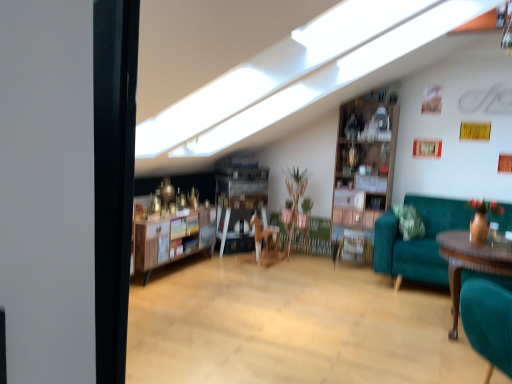
Measure the distance between wooden polished table at right and camera.

wooden polished table at right is 7.50 feet away from camera.

Identify the location of wooden polished table at right. (469, 264).

Is wooden shelf at center with wooden polished table at right?

No.

Considering the positions of points (246, 177) and (498, 268), is point (246, 177) closer to camera compared to point (498, 268)?

No, it is not.

Which object is further away from the camera taking this photo, wooden shelf at center or wooden polished table at right?

wooden shelf at center is further away from the camera.

Does wooden shelf at center appear on the right side of wooden polished table at right?

In fact, wooden shelf at center is to the left of wooden polished table at right.

Can you tell me how much wooden polished table at right and teal fabric couch at right differ in facing direction?

The facing directions of wooden polished table at right and teal fabric couch at right are 2.5 degrees apart.

Does wooden polished table at right appear on the left side of teal fabric couch at right?

Indeed, wooden polished table at right is positioned on the left side of teal fabric couch at right.

Based on the photo, which of these two, wooden polished table at right or teal fabric couch at right, stands taller?

Standing taller between the two is teal fabric couch at right.

Is wooden polished table at right to the left of wooden shelf at center from the viewer's perspective?

No, wooden polished table at right is not to the left of wooden shelf at center.

Is wooden shelf at center completely or partially inside wooden polished table at right?

No, wooden shelf at center is not a part of wooden polished table at right.

Locate an element on the screen. Image resolution: width=512 pixels, height=384 pixels. table in front of the wooden shelf at center is located at coordinates (469, 264).

Can you see wooden polished table at right touching wooden shelf at center?

No, wooden polished table at right is not with wooden shelf at center.

Is teal fabric couch at right behind wooden shelf at center?

That is False.

Measure the distance between teal fabric couch at right and wooden shelf at center.

A distance of 1.77 meters exists between teal fabric couch at right and wooden shelf at center.

Is teal fabric couch at right bigger or smaller than wooden shelf at center?

In the image, teal fabric couch at right appears to be larger than wooden shelf at center.

Are teal fabric couch at right and wooden shelf at center far apart?

Yes, teal fabric couch at right and wooden shelf at center are located far from each other.

Is the position of wooden shelf at center more distant than that of teal fabric couch at right?

Yes, the depth of wooden shelf at center is greater than that of teal fabric couch at right.

Looking at the image, does wooden shelf at center seem bigger or smaller compared to teal fabric couch at right?

Clearly, wooden shelf at center is smaller in size than teal fabric couch at right.

From a real-world perspective, between wooden shelf at center and teal fabric couch at right, who is vertically higher?

From a 3D spatial view, teal fabric couch at right is above.

In terms of size, does teal fabric couch at right appear bigger or smaller than wooden polished table at right?

Clearly, teal fabric couch at right is larger in size than wooden polished table at right.

Which object is more forward, teal fabric couch at right or wooden polished table at right?

wooden polished table at right is more forward.

Is teal fabric couch at right beside wooden polished table at right?

No, teal fabric couch at right is not in contact with wooden polished table at right.

Considering the relative sizes of teal fabric couch at right and wooden polished table at right in the image provided, is teal fabric couch at right wider than wooden polished table at right?

Yes, teal fabric couch at right is wider than wooden polished table at right.

In the image, there is a wooden shelf at center. Identify the location of table below it (from the image's perspective). The image size is (512, 384). (469, 264).

The image size is (512, 384). What are the coordinates of `studio couch above the wooden polished table at right (from a real-world perspective)` in the screenshot? It's located at (418, 240).

Which object lies further to the anchor point teal fabric couch at right, wooden polished table at right or wooden shelf at center?

wooden shelf at center lies further to teal fabric couch at right than the other object.

Estimate the real-world distances between objects in this image. Which object is closer to wooden shelf at center, wooden polished table at right or teal fabric couch at right?

teal fabric couch at right lies closer to wooden shelf at center than the other object.

Considering their positions, is wooden shelf at center positioned further to teal fabric couch at right than wooden polished table at right?

Based on the image, wooden shelf at center appears to be further to teal fabric couch at right.

Considering their positions, is wooden shelf at center positioned closer to wooden polished table at right than teal fabric couch at right?

Based on the image, teal fabric couch at right appears to be nearer to wooden polished table at right.

When comparing their distances from wooden shelf at center, does teal fabric couch at right or wooden polished table at right seem further?

Among the two, wooden polished table at right is located further to wooden shelf at center.

Which object lies further to the anchor point wooden polished table at right, teal fabric couch at right or wooden shelf at center?

The object further to wooden polished table at right is wooden shelf at center.

Where is `table between wooden shelf at center and teal fabric couch at right in the horizontal direction`? The height and width of the screenshot is (384, 512). table between wooden shelf at center and teal fabric couch at right in the horizontal direction is located at coordinates (469, 264).